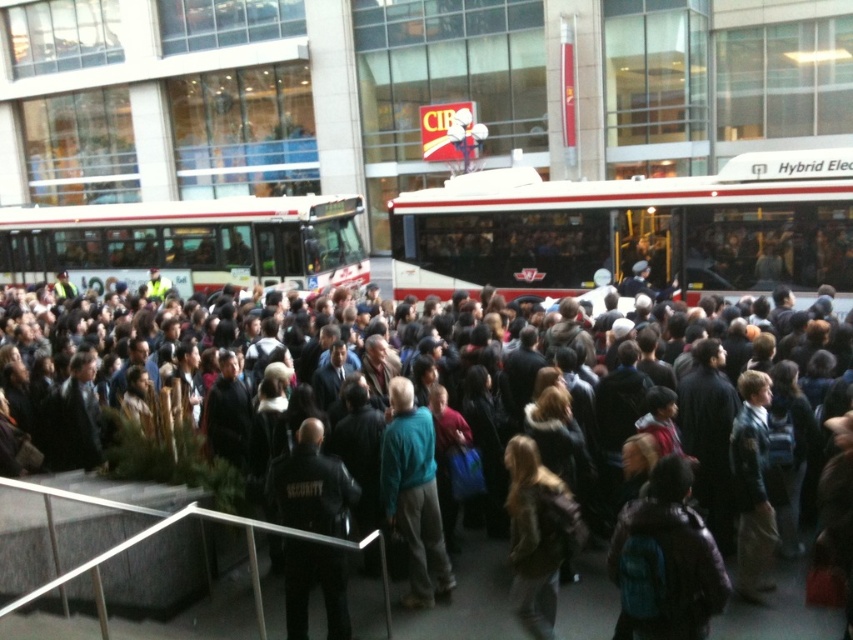
Question: Among these points, which one is farthest from the camera?

Choices:
 (A) (426, 582)
 (B) (305, 600)

Answer: (A)

Question: Which point is closer to the camera?

Choices:
 (A) (426, 602)
 (B) (229, 609)
 (C) (781, 198)

Answer: (A)

Question: Does dark brown leather jacket at center lie in front of black leather jacket at center?

Choices:
 (A) yes
 (B) no

Answer: (B)

Question: Does brown leather jacket at center have a greater width compared to blue denim jacket at center?

Choices:
 (A) yes
 (B) no

Answer: (A)

Question: Which point is farther to the camera?

Choices:
 (A) (733, 472)
 (B) (389, 493)

Answer: (A)

Question: Does dark brown leather jacket at center come in front of black leather jacket at center?

Choices:
 (A) no
 (B) yes

Answer: (A)